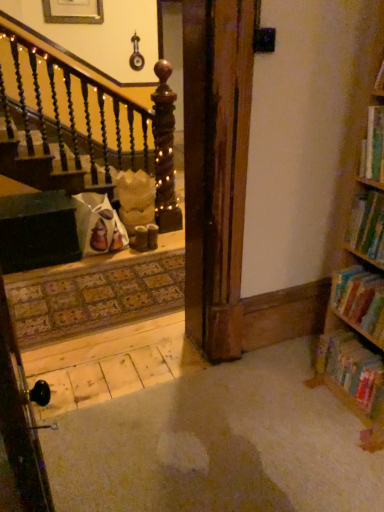
Question: From the image's perspective, is multicolored cardboard book at lower right, arranged as the first book when ordered from the bottom, under hardcover book at upper right, the 4th book when ordered from bottom to top?

Choices:
 (A) yes
 (B) no

Answer: (A)

Question: Is multicolored cardboard book at lower right, which is the 4th book from top to bottom, behind hardcover book at upper right, the 4th book when ordered from bottom to top?

Choices:
 (A) no
 (B) yes

Answer: (B)

Question: Could you tell me if multicolored cardboard book at lower right, which is the 4th book from top to bottom, is turned towards hardcover book at upper right, the 1th book viewed from the top?

Choices:
 (A) yes
 (B) no

Answer: (B)

Question: From the image's perspective, is multicolored cardboard book at lower right, arranged as the first book when ordered from the bottom, on top of hardcover book at upper right, the 4th book when ordered from bottom to top?

Choices:
 (A) yes
 (B) no

Answer: (B)

Question: From a real-world perspective, is multicolored cardboard book at lower right, which is the 4th book from top to bottom, on hardcover book at upper right, the 1th book viewed from the top?

Choices:
 (A) no
 (B) yes

Answer: (A)

Question: Is multicolored cardboard book at lower right, which is the 4th book from top to bottom, oriented away from hardcover book at upper right, the 1th book viewed from the top?

Choices:
 (A) no
 (B) yes

Answer: (A)

Question: Does hardcover book at right, marked as the second book in a bottom-to-top arrangement, appear on the right side of multicolored cardboard book at lower right, arranged as the first book when ordered from the bottom?

Choices:
 (A) no
 (B) yes

Answer: (B)

Question: Is hardcover book at right, which appears as the 3th book when viewed from the top, located outside multicolored cardboard book at lower right, arranged as the first book when ordered from the bottom?

Choices:
 (A) no
 (B) yes

Answer: (B)

Question: Is hardcover book at right, marked as the second book in a bottom-to-top arrangement, aimed at multicolored cardboard book at lower right, which is the 4th book from top to bottom?

Choices:
 (A) yes
 (B) no

Answer: (B)

Question: Can you confirm if hardcover book at right, which appears as the 3th book when viewed from the top, is smaller than multicolored cardboard book at lower right, arranged as the first book when ordered from the bottom?

Choices:
 (A) no
 (B) yes

Answer: (A)

Question: Is hardcover book at right, marked as the second book in a bottom-to-top arrangement, looking in the opposite direction of multicolored cardboard book at lower right, arranged as the first book when ordered from the bottom?

Choices:
 (A) yes
 (B) no

Answer: (B)

Question: Can you confirm if hardcover book at right, which appears as the 3th book when viewed from the top, is wider than multicolored cardboard book at lower right, which is the 4th book from top to bottom?

Choices:
 (A) no
 (B) yes

Answer: (A)

Question: Can you confirm if green matte bookshelf at right, which is the third book from bottom to top, is positioned to the right of hardcover book at right, marked as the second book in a bottom-to-top arrangement?

Choices:
 (A) no
 (B) yes

Answer: (A)